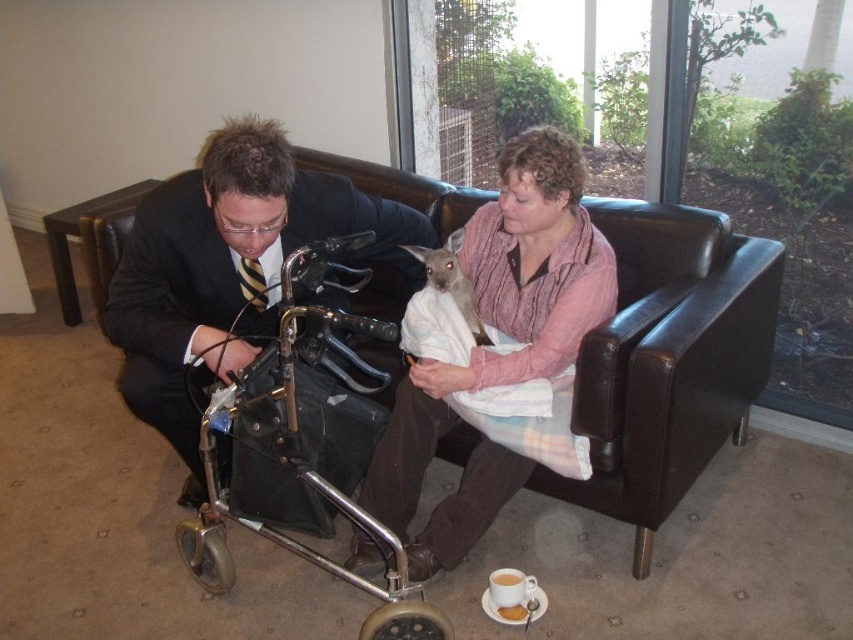
Consider the image. You are a physical therapist observing the dark blue suit at center and the metallic silver walker at lower left in the image. Which object is wider?

The dark blue suit at center is wider than the metallic silver walker at lower left.